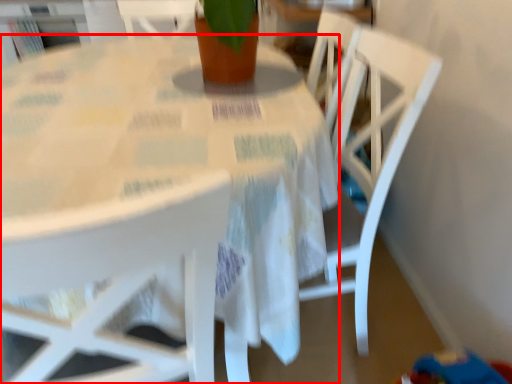
Question: From the image, what is the correct spatial relationship of table (annotated by the red box) in relation to chair?

Choices:
 (A) left
 (B) right

Answer: (A)